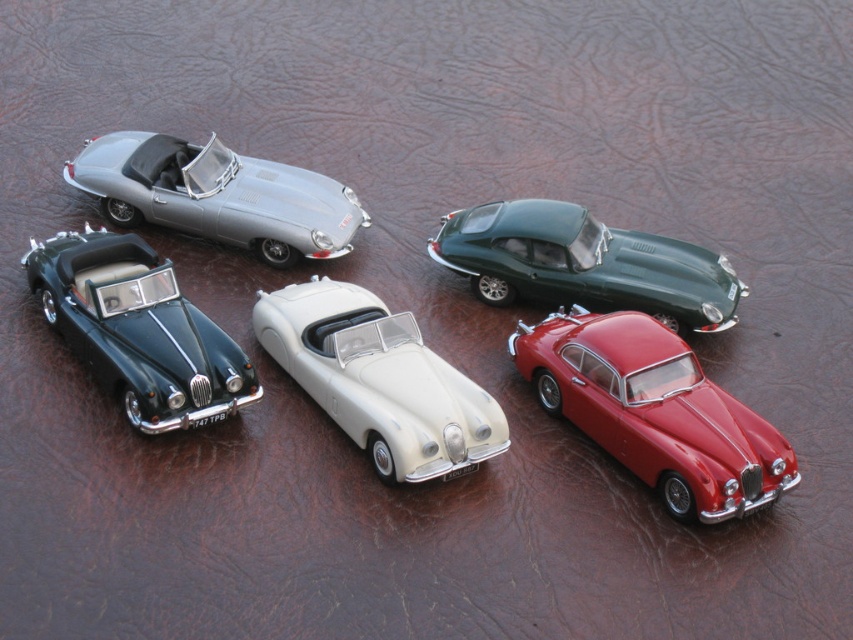
You are a toy collector who wants to display these cars in a straight line. The glossy red car at lower right and the shiny dark green convertible at lower left are currently 14.74 feet apart. If you want to place them exactly 10 feet apart, how much space do you need to reduce between them?

The glossy red car at lower right and the shiny dark green convertible at lower left are currently 14.74 feet apart. To place them exactly 10 feet apart, you need to reduce the space between them by 4.74 feet.

You are standing at the center of the arrangement looking at the two points, point 1 at (654, 452) and point 2 at (241, 220). Which point is closer to you?

Point 1 at (654, 452) is in front of point 2 at (241, 220), so it is closer to you.